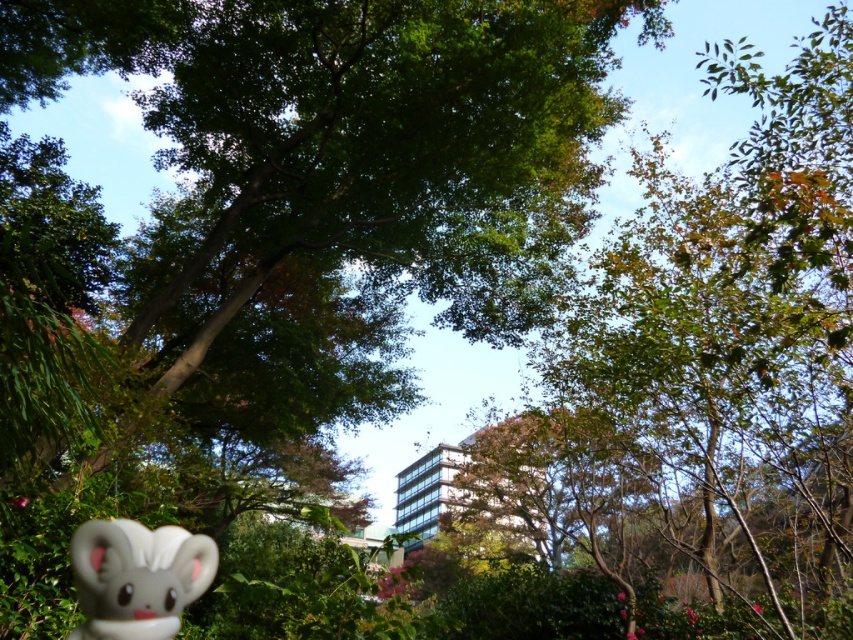
You are a photographer trying to capture a clear shot of the white matte plush toy at lower left. However, the green leafy tree at center is blocking your view. Can you move closer to the toy to get a better shot without the tree obstructing the view?

The green leafy tree at center is further to the viewer than the white matte plush toy at lower left, so moving closer to the toy would bring it nearer while the tree remains closer to you, potentially reducing obstruction. However, since the tree is already in front, it might still block the view depending on the distance moved.

You are a photographer who wants to capture the white matte plush toy at lower left without any obstruction from the green leafy tree at center. Based on the scene, is this possible?

The green leafy tree at center is larger than the white matte plush toy at lower left, so it might obstruct the view. However, since the plush toy is at the lower left and the tree is at the center, adjusting the camera angle downward could allow capturing the plush toy without the tree blocking it.

Based on the photo, you are a photographer setting up a shot of the green leafy tree at center and the white matte plush toy at lower left. You want to frame the scene so that the tree appears to the right of the toy. Is this possible with their current positions?

The green leafy tree at center is positioned on the left side of white matte plush toy at lower left, so to frame the tree to the right of the toy, you would need to adjust their positions since currently the tree is to the left of the toy.